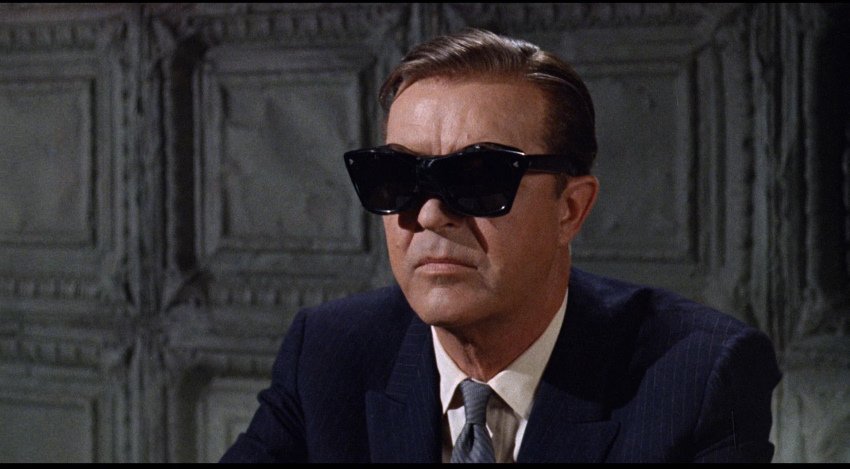
Identify the location of wall. Image resolution: width=850 pixels, height=469 pixels. (677, 210).